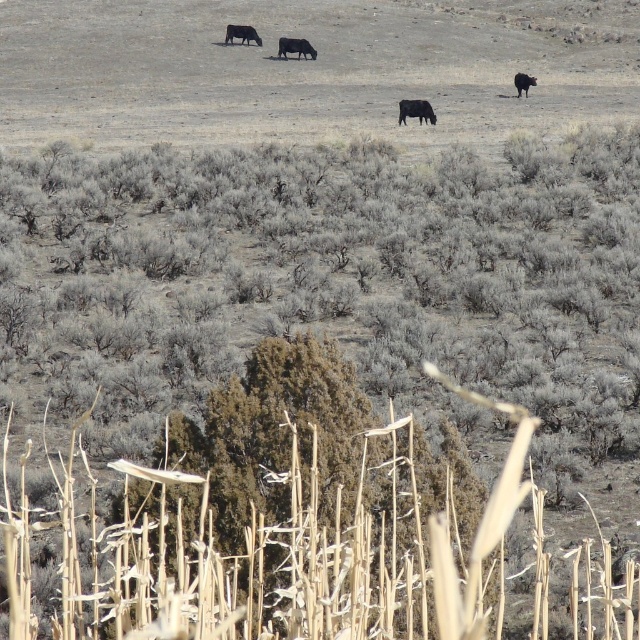
You are a farmer checking your herd in this arid landscape. You notice two cows, the black glossy cow at center and the black matte cow at upper center. Which cow is closer to you?

The black glossy cow at center is closer to you because it appears bigger than the black matte cow at upper center, which is smaller and farther away.

You are a farmer checking on your cows in this dry field. You notice two cows, the black glossy cow at center and the black matte cow at upper right. How far apart are these two cows from each other?

The black glossy cow at center is 13.01 meters away from the black matte cow at upper right.

You are a farmer checking the health of your cows. You observe the black glossy cow at center and the black matte cow at upper center. Which cow is wider?

The black matte cow at upper center is wider than the black glossy cow at center.